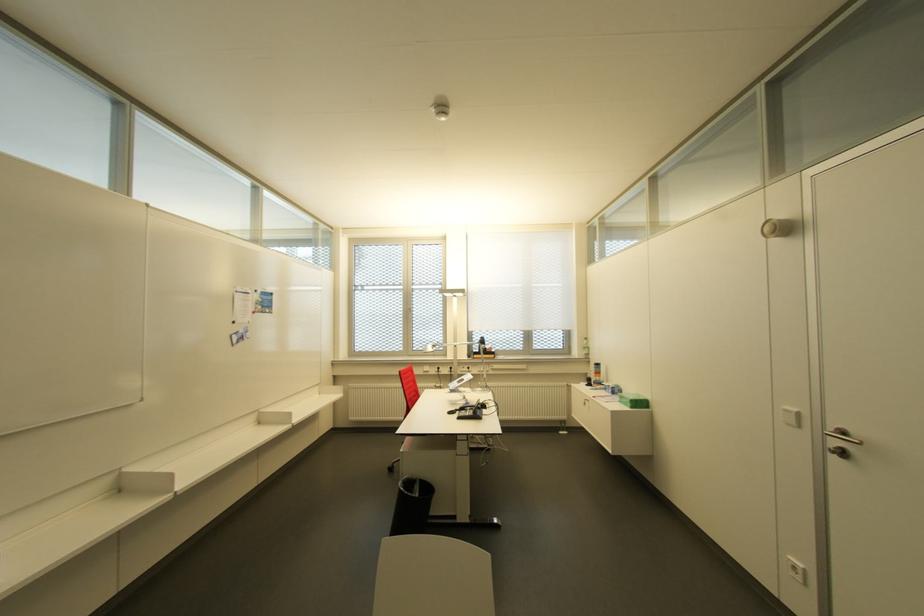
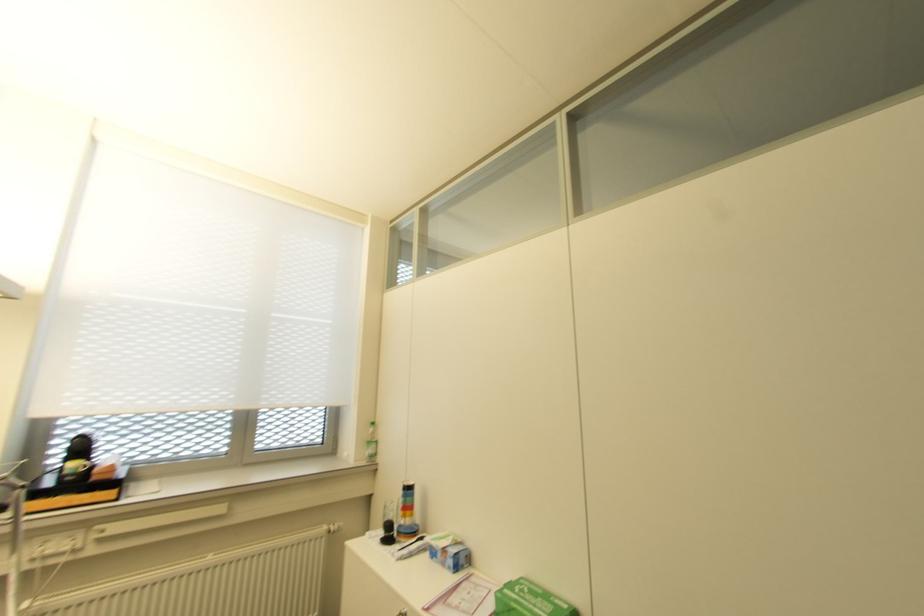
In the second image, find the point that corresponds to the point at 611,392 in the first image.

(454, 568)